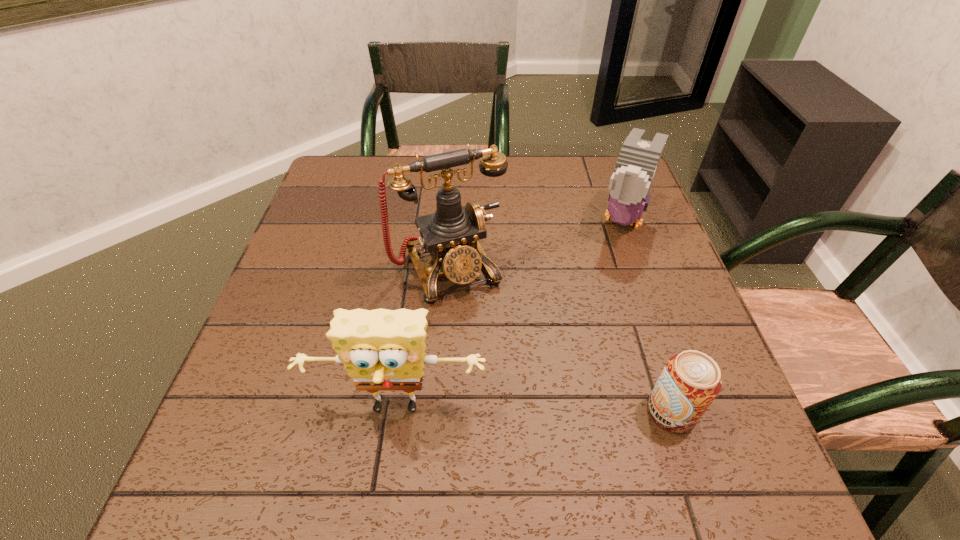
Find the location of a particular element. The image size is (960, 540). free spot on the desktop that is between the sponge and the shortest object and is positioned at the beak of the bird is located at coordinates coord(539,410).

The width and height of the screenshot is (960, 540). In order to click on vacant space on the desktop that is between the sponge and the beer can and is positioned on the front of the telephone, featuring the rotary dial in this screenshot , I will do `click(518, 410)`.